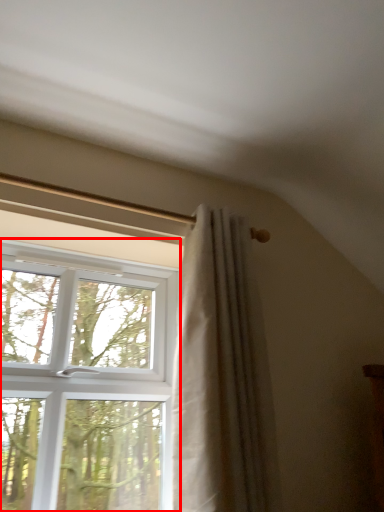
Question: From the image's perspective, where is window (annotated by the red box) located relative to curtain?

Choices:
 (A) below
 (B) above

Answer: (A)